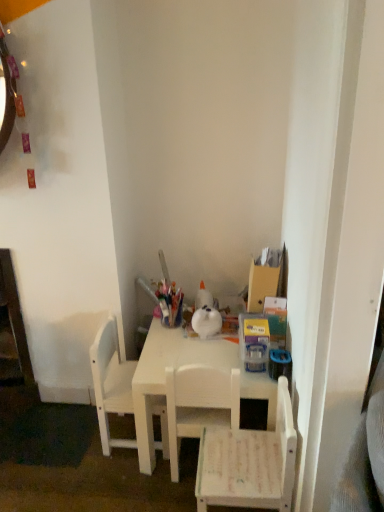
At what (x,y) coordinates should I click in order to perform the action: click on vacant space positioned to the left of white matte chair at left, the first chair positioned from the left. Please return your answer as a coordinate pair (x, y). This screenshot has height=512, width=384. Looking at the image, I should click on (71, 438).